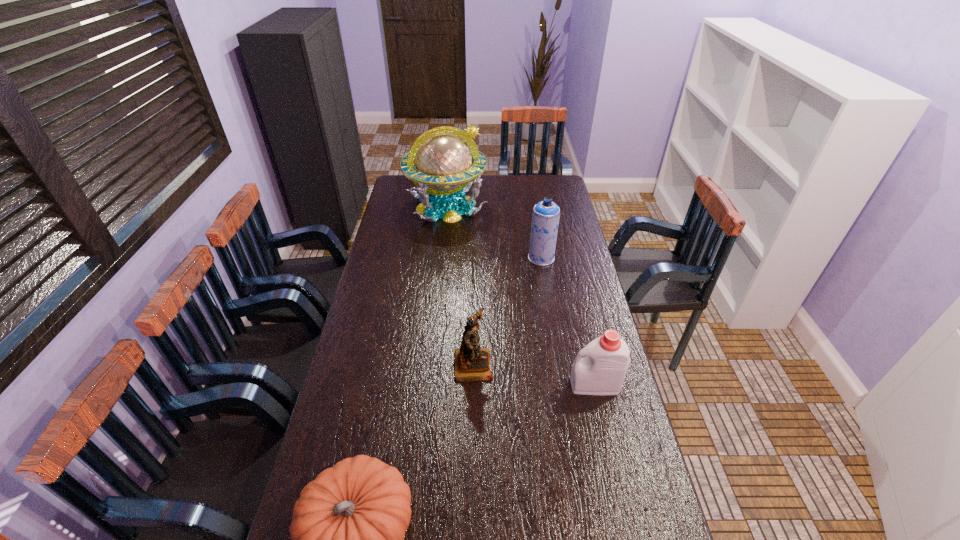
Where is `vacant area situated on the handle side of the detergent`? vacant area situated on the handle side of the detergent is located at coordinates (507, 385).

This screenshot has width=960, height=540. Identify the location of vacant space situated on the handle side of the detergent. (498, 385).

In order to click on object positioned at the far edge in this screenshot , I will do `click(445, 165)`.

You are a GUI agent. You are given a task and a screenshot of the screen. Output one action in this format:
    pyautogui.click(x=<x>, y=<y>)
    Task: Click on the object at the left edge
    
    Given the screenshot: What is the action you would take?
    pyautogui.click(x=445, y=165)

Image resolution: width=960 pixels, height=540 pixels. In order to click on aerosol can present at the right edge in this screenshot , I will do `click(545, 219)`.

Image resolution: width=960 pixels, height=540 pixels. Identify the location of detergent present at the right edge. (602, 371).

You are a GUI agent. You are given a task and a screenshot of the screen. Output one action in this format:
    pyautogui.click(x=<x>, y=<y>)
    Task: Click on the object present at the far left corner
    The height and width of the screenshot is (540, 960).
    Given the screenshot: What is the action you would take?
    pyautogui.click(x=445, y=165)

Find the location of a particular element. The image size is (960, 540). free point at the left edge is located at coordinates (340, 404).

You are a GUI agent. You are given a task and a screenshot of the screen. Output one action in this format:
    pyautogui.click(x=<x>, y=<y>)
    Task: Click on the free space at the right edge of the desktop
    This screenshot has height=540, width=960.
    Given the screenshot: What is the action you would take?
    pyautogui.click(x=568, y=273)

The height and width of the screenshot is (540, 960). Find the location of `blank space at the far left corner`. blank space at the far left corner is located at coordinates (403, 181).